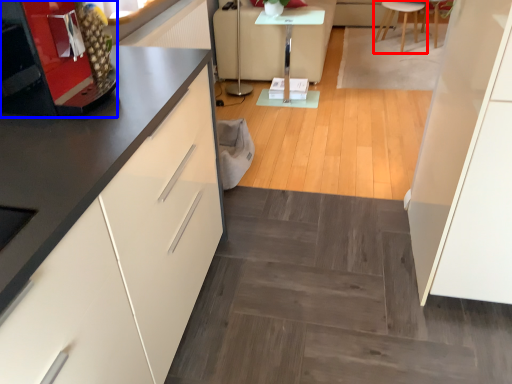
Question: Which point is further to the camera, furniture (highlighted by a red box) or appliance (highlighted by a blue box)?

Choices:
 (A) furniture
 (B) appliance

Answer: (A)